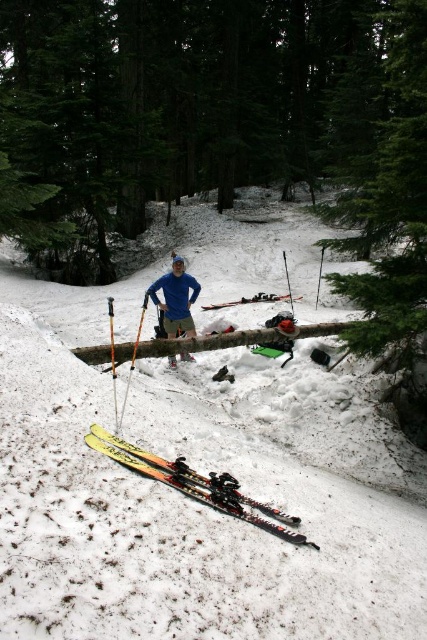
Question: Is green matte tree at center to the left of green textured tree at upper right from the viewer's perspective?

Choices:
 (A) yes
 (B) no

Answer: (A)

Question: Which object appears closest to the camera in this image?

Choices:
 (A) orange textured ski pole at center
 (B) blue fabric pants at center

Answer: (A)

Question: In this image, where is white fluffy snow at center located relative to matte black skis at center?

Choices:
 (A) left
 (B) right

Answer: (A)

Question: Is blue fabric pants at center bigger than matte black skis at center?

Choices:
 (A) yes
 (B) no

Answer: (B)

Question: Which object appears farthest from the camera in this image?

Choices:
 (A) yellow plastic ski pole at center
 (B) yellow matte skis at lower left
 (C) white fluffy snow at center
 (D) matte black skis at center

Answer: (D)

Question: Among these points, which one is nearest to the camera?

Choices:
 (A) (225, 97)
 (B) (187, 324)

Answer: (B)